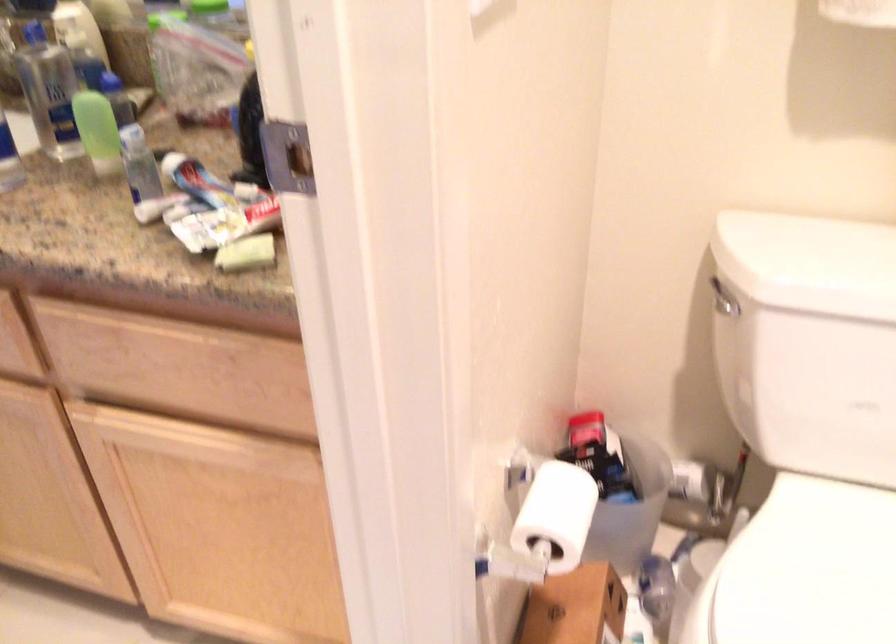
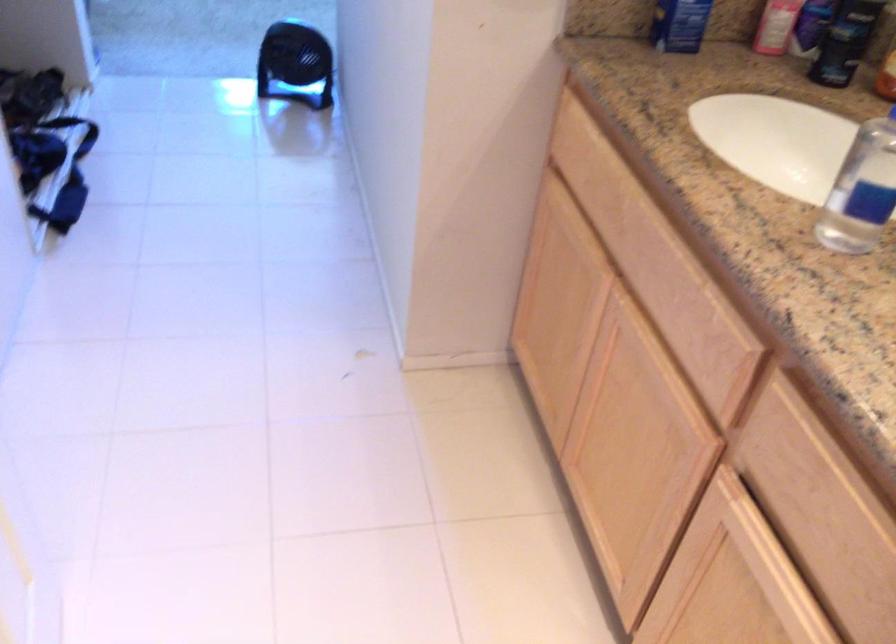
The images are taken continuously from a first-person perspective. In which direction is your viewpoint rotating?

The rotation direction of the camera is left-down.